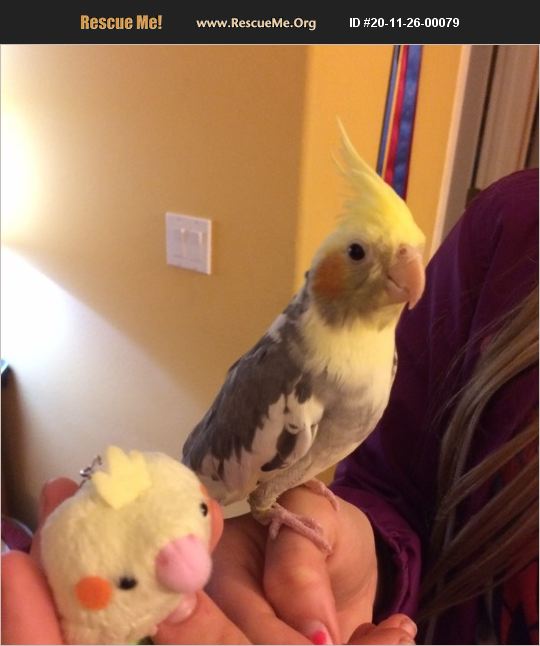
Locate an element on the screen. The image size is (540, 646). switch is located at coordinates (198, 231).